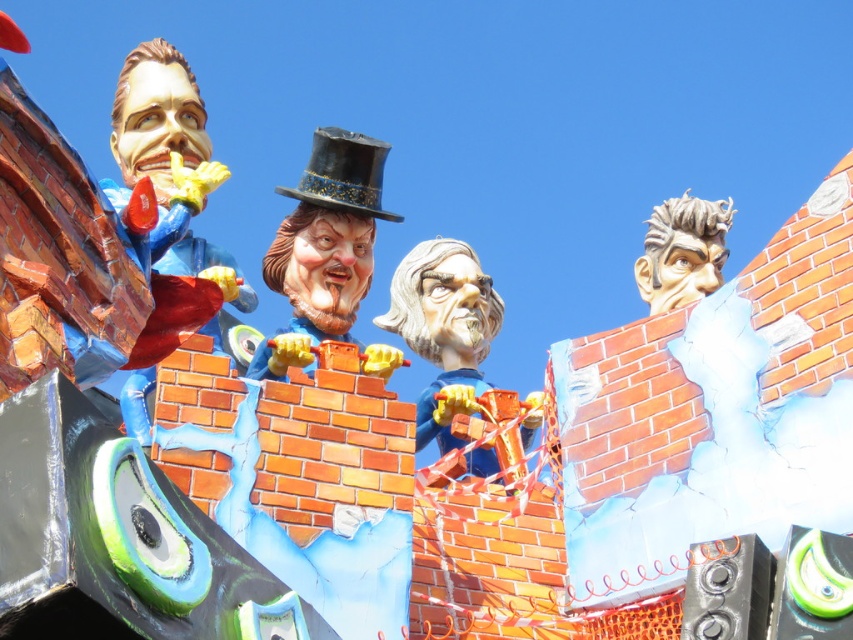
Is the position of matte blue figure at center less distant than that of sculpted gray hair at upper right?

That is True.

Looking at this image, between matte blue figure at center and sculpted gray hair at upper right, which one appears on the right side from the viewer's perspective?

From the viewer's perspective, sculpted gray hair at upper right appears more on the right side.

Locate an element on the screen. matte blue figure at center is located at coordinates (444, 330).

Who is positioned more to the right, matte gold statue at center or matte blue figure at center?

matte blue figure at center

Which is in front, point (309, 362) or point (456, 241)?

Point (309, 362) is in front.

At what (x,y) coordinates should I click in order to perform the action: click on matte gold statue at center. Please return your answer as a coordinate pair (x, y). The width and height of the screenshot is (853, 640). Looking at the image, I should click on (323, 246).

Measure the distance between point [286,333] and camera.

Point [286,333] is 293.58 feet from camera.

Does point (270, 348) come in front of point (650, 218)?

That is True.

Identify the location of matte gold statue at center. The height and width of the screenshot is (640, 853). (323, 246).

Identify the location of matte gold statue at center. (323, 246).